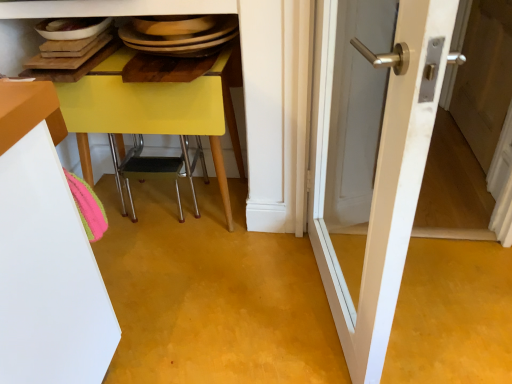
Question: Is point (504, 69) positioned closer to the camera than point (329, 64)?

Choices:
 (A) farther
 (B) closer

Answer: (A)

Question: From a real-world perspective, is white wood screen door at right physically located above or below white glossy door at center?

Choices:
 (A) below
 (B) above

Answer: (A)

Question: Which object is the closest to the white wood screen door at right?

Choices:
 (A) yellow plastic chair at lower center
 (B) white glossy door at center

Answer: (B)

Question: Which object is the closest to the yellow plastic chair at lower center?

Choices:
 (A) white wood screen door at right
 (B) white glossy door at center

Answer: (B)